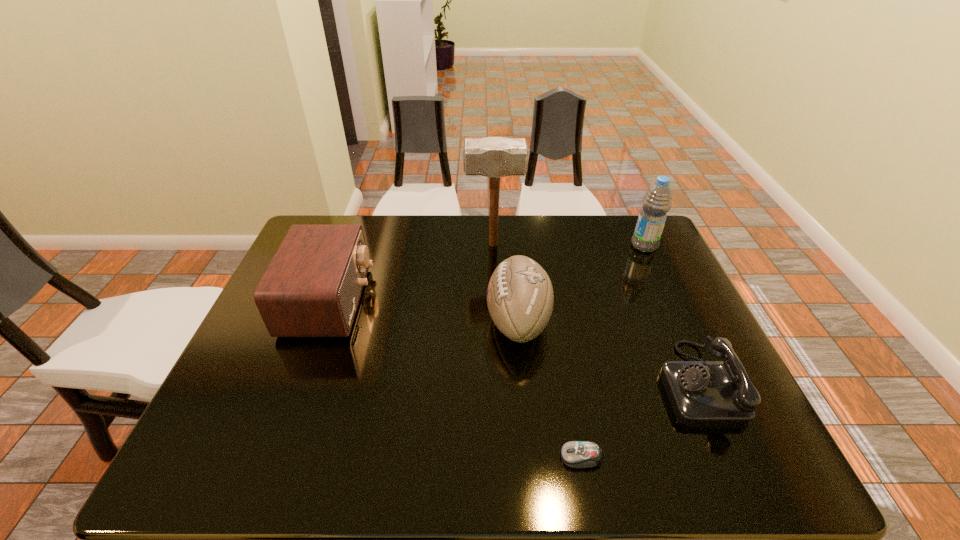
This screenshot has height=540, width=960. What are the coordinates of `free space located 0.180m on the front of the water bottle` in the screenshot? It's located at (666, 294).

Find the location of a particular element. Image resolution: width=960 pixels, height=540 pixels. free space located 0.080m on the laces of the football (American) is located at coordinates (455, 320).

Where is `vacant space located on the laces of the football (American)`? vacant space located on the laces of the football (American) is located at coordinates (367, 320).

The image size is (960, 540). In order to click on free spot located on the laces of the football (American) in this screenshot , I will do `click(359, 320)`.

Identify the location of vacant space located 0.270m on the front panel of the radio receiver. This screenshot has height=540, width=960. (466, 301).

Where is `free location located on the dial of the telephone`? The width and height of the screenshot is (960, 540). free location located on the dial of the telephone is located at coordinates (622, 383).

I want to click on vacant region located on the dial of the telephone, so pos(596,383).

Find the location of a particular element. The width and height of the screenshot is (960, 540). vacant area situated on the dial of the telephone is located at coordinates pyautogui.click(x=499, y=383).

This screenshot has width=960, height=540. I want to click on vacant space located 0.100m on the wheel side of the computer mouse, so click(x=510, y=457).

Locate an element on the screen. The width and height of the screenshot is (960, 540). free space located 0.330m on the wheel side of the computer mouse is located at coordinates (393, 457).